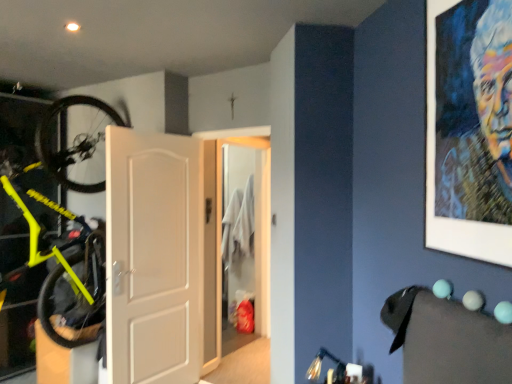
Question: Is oil painting portrait at upper right bigger or smaller than neon yellow matte bicycle at left?

Choices:
 (A) small
 (B) big

Answer: (A)

Question: Does point (442, 183) appear closer or farther from the camera than point (27, 188)?

Choices:
 (A) farther
 (B) closer

Answer: (B)

Question: Estimate the real-world distances between objects in this image. Which object is closer to the neon yellow matte bicycle at left?

Choices:
 (A) white matte door at center, positioned as the 1th door in left-to-right order
 (B) white glossy door at center, which is the 1th door in right-to-left order
 (C) oil painting portrait at upper right

Answer: (A)

Question: Which object is the farthest from the neon yellow matte bicycle at left?

Choices:
 (A) white matte door at center, the second door positioned from the right
 (B) oil painting portrait at upper right
 (C) white glossy door at center, which is counted as the 2th door, starting from the front

Answer: (B)